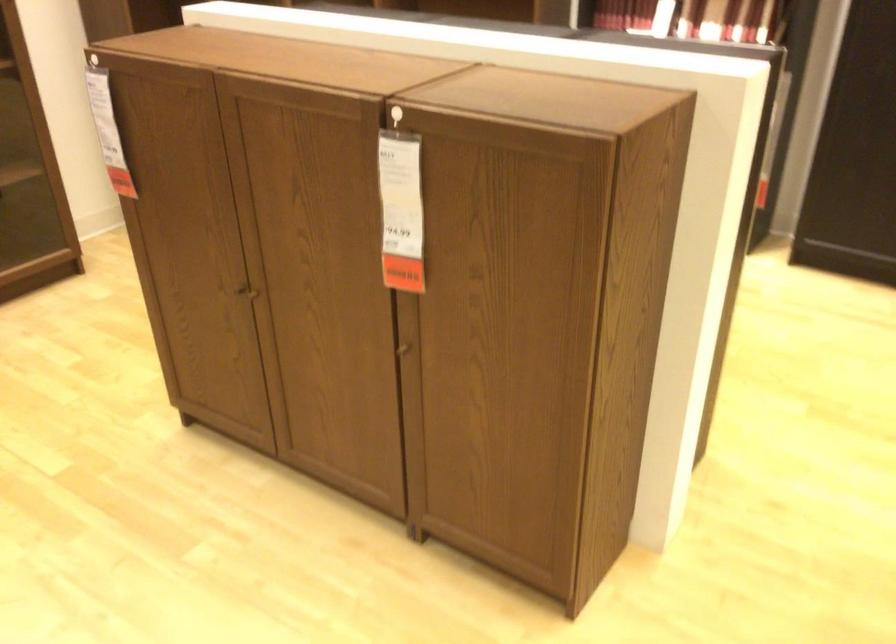
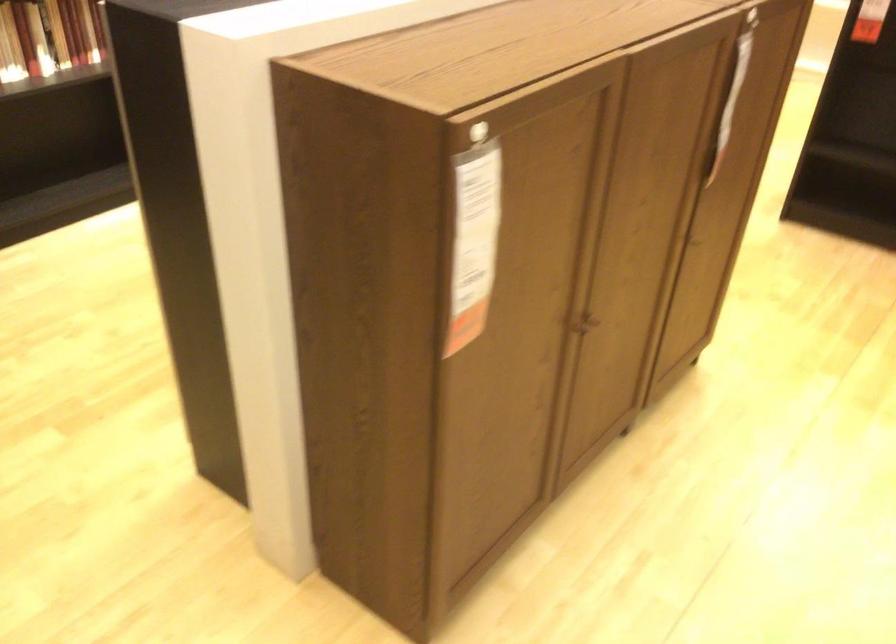
Find the pixel in the second image that matches (246,285) in the first image.

(583, 323)